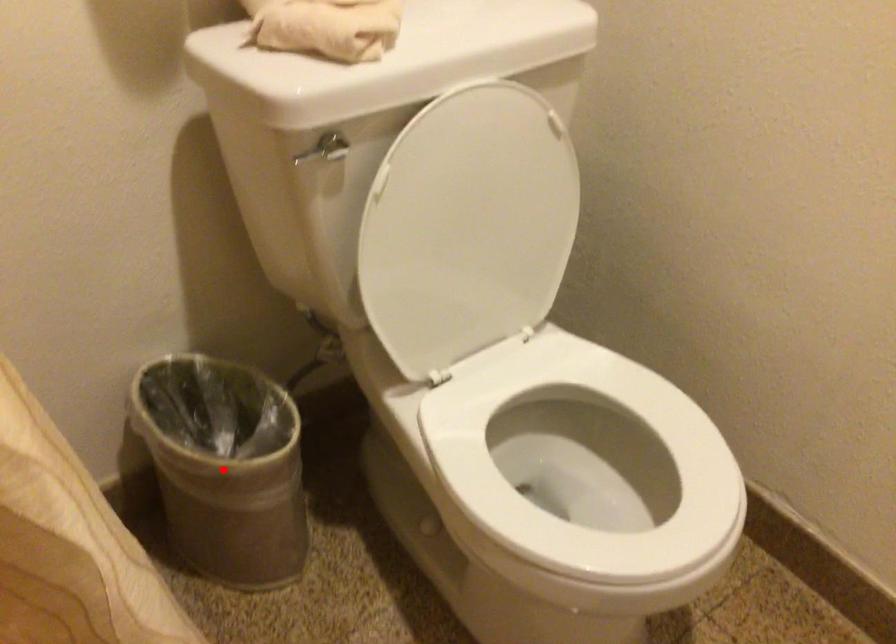
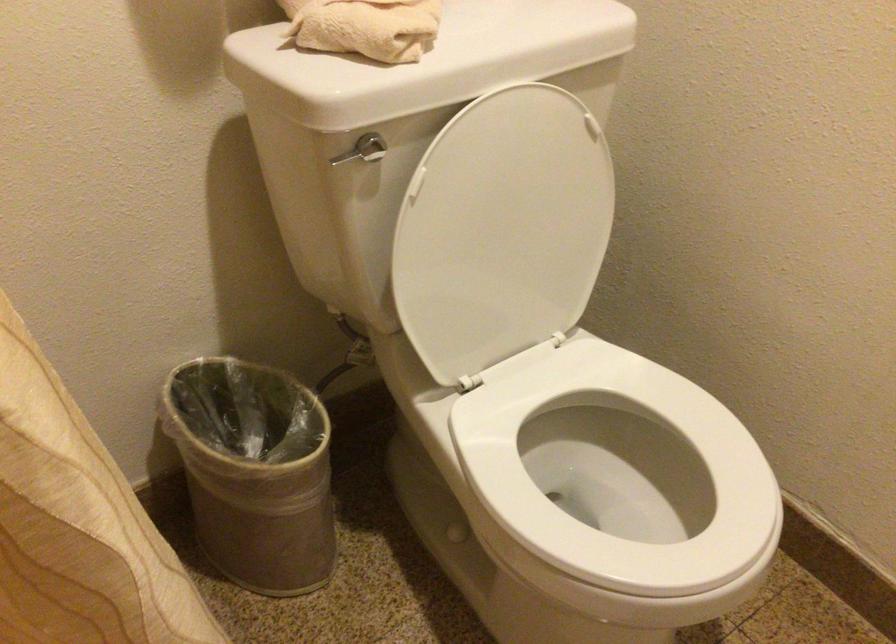
Where in the second image is the point corresponding to the highlighted location from the first image?

(254, 471)